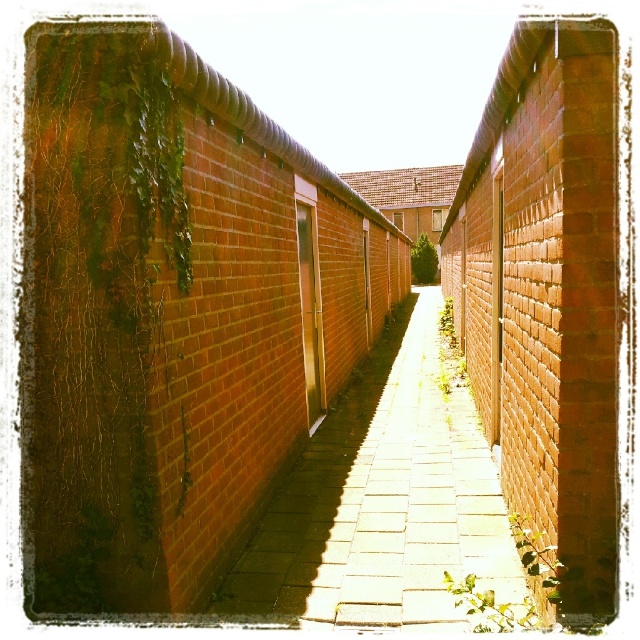
You are a delivery robot with a width of 1.5 meters. You need to navigate through the alleyway shown in the image. Can you fit between the green leafy ivy at left and the brick paved path at center without touching either?

The distance between the green leafy ivye at left and the brick paved path at center is 1.67 meters. Since the robot is 1.5 meters wide, there is enough space to pass through without touching either side.

You are a painter who wants to paint the green leafy ivy at left and the brick paved path at center in the alleyway. Which object should you focus on first if you want to paint the smaller one first?

The green leafy ivy at left has a smaller size compared to the brick paved path at center, so you should focus on painting the green leafy ivy at left first.

You are a painter who wants to paint both the green leafy ivy at left and the brick paved path at center. Which object requires more paint if you consider their widths?

The brick paved path at center requires more paint because its width is greater than the green leafy ivy at left.